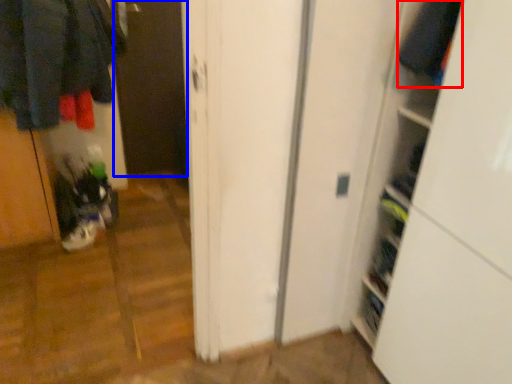
Question: Among these objects, which one is nearest to the camera, clothing (highlighted by a red box) or screen door (highlighted by a blue box)?

Choices:
 (A) clothing
 (B) screen door

Answer: (A)